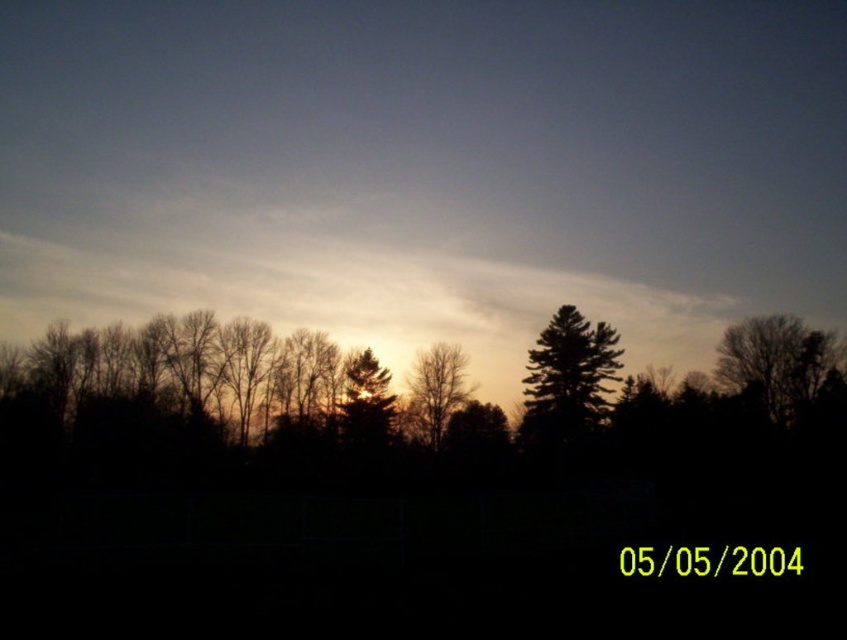
Which is above, brown matte tree at center or silvery metallic tree at center?

brown matte tree at center

Is brown matte tree at center above silvery metallic tree at center?

Correct, brown matte tree at center is located above silvery metallic tree at center.

Between point (461, 374) and point (378, 440), which one is positioned in front?

Point (378, 440) is in front.

The image size is (847, 640). I want to click on brown matte tree at center, so click(x=436, y=388).

Which is in front, point (558, 435) or point (778, 394)?

Point (778, 394) is more forward.

Describe the element at coordinates (567, 381) in the screenshot. This screenshot has width=847, height=640. I see `dark green textured tree at center` at that location.

At what (x,y) coordinates should I click in order to perform the action: click on dark green textured tree at center. Please return your answer as a coordinate pair (x, y). The width and height of the screenshot is (847, 640). Looking at the image, I should click on click(x=567, y=381).

Who is positioned more to the right, dark green textured tree at center or silvery metallic tree at center?

Positioned to the right is dark green textured tree at center.

Between point (601, 321) and point (378, 428), which one is positioned behind?

The point (601, 321) is more distant.

The width and height of the screenshot is (847, 640). I want to click on dark green textured tree at center, so click(x=567, y=381).